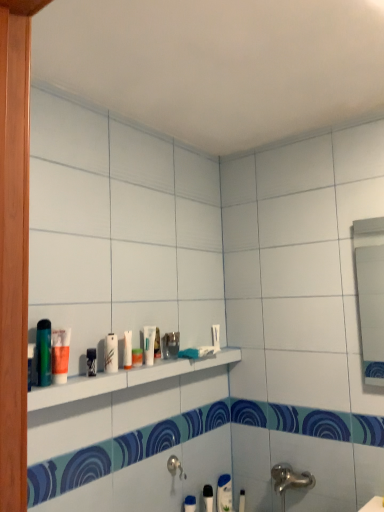
Question: In which direction should I rotate to look at white glossy tube at center, the fifth toiletry positioned from the back?

Choices:
 (A) right
 (B) left

Answer: (B)

Question: Are white matte tube at lower center, the 1th toiletry viewed from the back, and metallic glass at center, which is counted as the fifth toiletry, starting from the top, far apart?

Choices:
 (A) yes
 (B) no

Answer: (B)

Question: Would you say white matte tube at lower center, acting as the first toiletry starting from the right, contains metallic glass at center, the fifth toiletry in the front-to-back sequence?

Choices:
 (A) yes
 (B) no

Answer: (B)

Question: Does white matte tube at lower center, placed as the seventh toiletry when sorted from left to right, have a greater height compared to metallic glass at center, the fifth toiletry in the front-to-back sequence?

Choices:
 (A) no
 (B) yes

Answer: (B)

Question: Is white matte tube at lower center, acting as the first toiletry starting from the right, behind metallic glass at center, which is counted as the fifth toiletry, starting from the top?

Choices:
 (A) yes
 (B) no

Answer: (A)

Question: Is white matte tube at lower center, acting as the first toiletry starting from the right, bigger than metallic glass at center, which is counted as the fifth toiletry, starting from the top?

Choices:
 (A) no
 (B) yes

Answer: (A)

Question: Is white matte tube at lower center, the 1th toiletry viewed from the back, positioned before metallic glass at center, positioned as the 3th toiletry in bottom-to-top order?

Choices:
 (A) no
 (B) yes

Answer: (A)

Question: Considering the relative sizes of white matte toothpaste at lower right, the second toothpaste positioned from the front, and black plastic razor at center, which is the 6th toiletry from right to left, in the image provided, is white matte toothpaste at lower right, the second toothpaste positioned from the front, taller than black plastic razor at center, which is the 6th toiletry from right to left,?

Choices:
 (A) yes
 (B) no

Answer: (A)

Question: Is white matte toothpaste at lower right, the first toothpaste viewed from the right, bigger than black plastic razor at center, positioned as the fifth toiletry in bottom-to-top order?

Choices:
 (A) yes
 (B) no

Answer: (A)

Question: Does white matte toothpaste at lower right, the first toothpaste viewed from the right, have a greater width compared to black plastic razor at center, placed as the 2th toiletry when sorted from front to back?

Choices:
 (A) no
 (B) yes

Answer: (B)

Question: Does white matte toothpaste at lower right, which appears as the second toothpaste when viewed from the left, lie behind black plastic razor at center, which ranks as the sixth toiletry in back-to-front order?

Choices:
 (A) yes
 (B) no

Answer: (A)

Question: Does white matte toothpaste at lower right, acting as the first toothpaste starting from the back, have a smaller size compared to black plastic razor at center, positioned as the fifth toiletry in bottom-to-top order?

Choices:
 (A) no
 (B) yes

Answer: (A)

Question: Is white matte toothpaste at lower right, the first toothpaste viewed from the right, in front of black plastic razor at center, marked as the second toiletry in a left-to-right arrangement?

Choices:
 (A) yes
 (B) no

Answer: (B)

Question: Can you confirm if black plastic toothbrush at lower center, which is the second toiletry in back-to-front order, is taller than white glossy tube at center, which is the fourth toiletry from left to right?

Choices:
 (A) yes
 (B) no

Answer: (A)